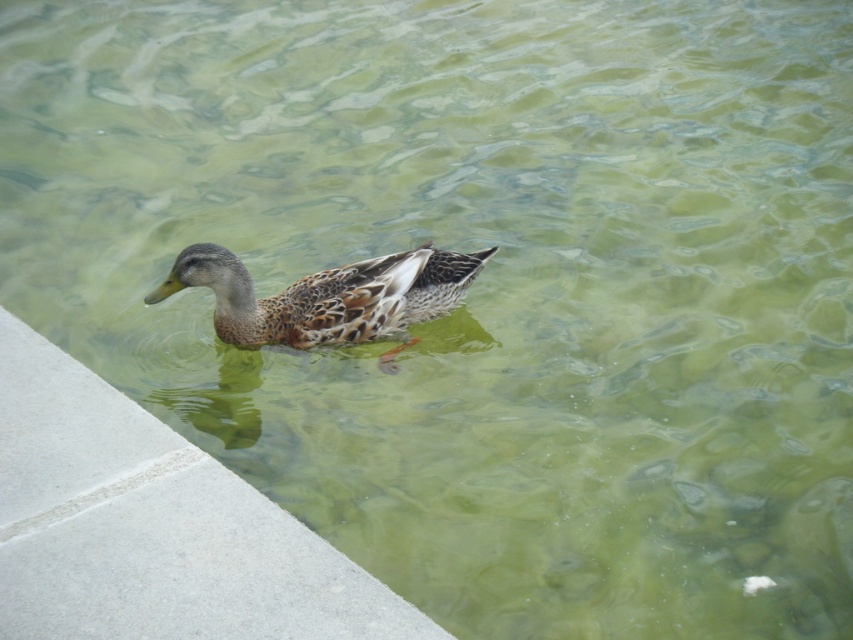
You are a photographer trying to capture the brown speckled duck at center from the gray concrete ledge at lower left. Can you see the duck clearly from your position on the ledge?

The gray concrete ledge at lower left is taller than brown speckled duck at center, so yes, you can see the duck clearly from your position on the ledge because the ledge is elevated above the duck.

Looking at this image, you are a photographer trying to capture the brown speckled duck at center. You want to ensure the gray concrete ledge at lower left does not block the duck in your shot. Based on their sizes, is the ledge wider than the duck?

The gray concrete ledge at lower left might be wider than brown speckled duck at center, so there is a possibility that the ledge could block the duck in your shot if not positioned carefully.